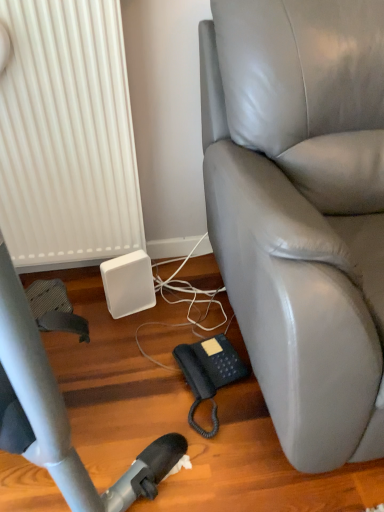
Locate an element on the screen. The height and width of the screenshot is (512, 384). vacant space in front of black rubberized phone at lower center is located at coordinates (228, 466).